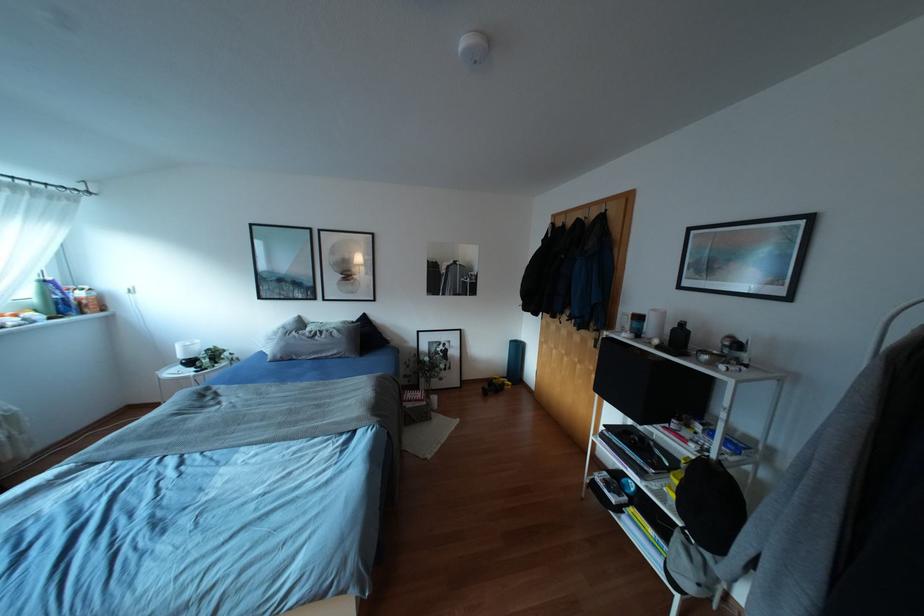
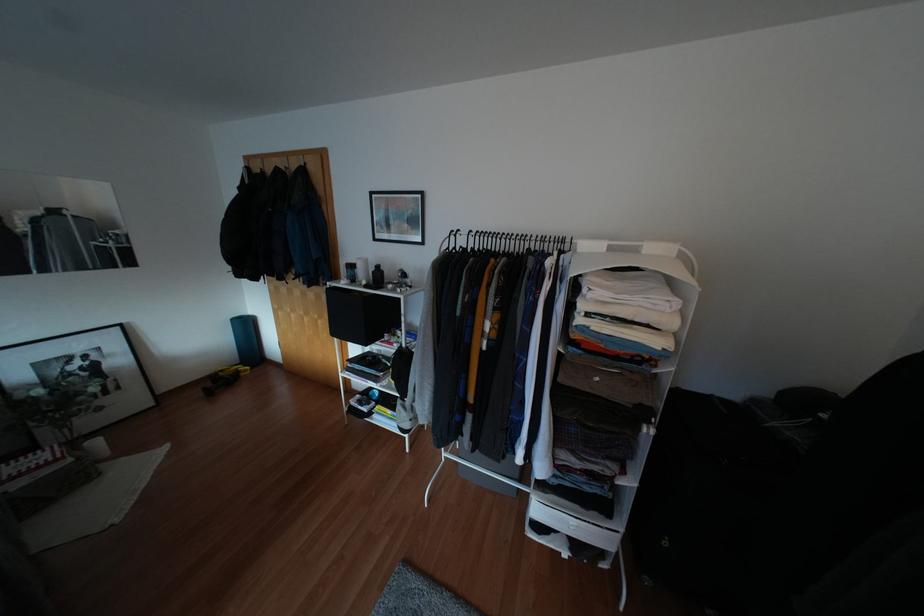
In the second image, find the point that corresponds to (x=691, y=456) in the first image.

(394, 351)